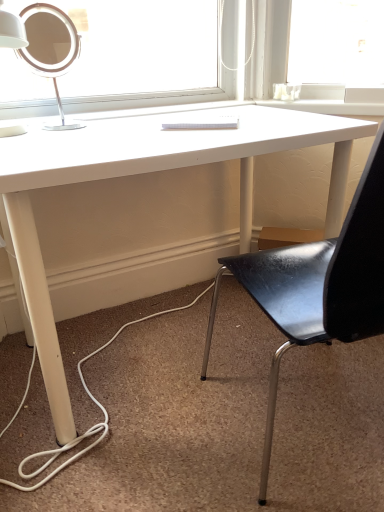
Question: Is black leather chair at center smaller than white matte desk at center?

Choices:
 (A) yes
 (B) no

Answer: (A)

Question: From a real-world perspective, is black leather chair at center on white matte desk at center?

Choices:
 (A) no
 (B) yes

Answer: (B)

Question: Is black leather chair at center taller than white matte desk at center?

Choices:
 (A) no
 (B) yes

Answer: (B)

Question: Is black leather chair at center positioned beyond the bounds of white matte desk at center?

Choices:
 (A) yes
 (B) no

Answer: (A)

Question: Is black leather chair at center far from white matte desk at center?

Choices:
 (A) no
 (B) yes

Answer: (A)

Question: Could you tell me if black leather chair at center is facing white matte desk at center?

Choices:
 (A) no
 (B) yes

Answer: (B)

Question: Are black leather chair at center and matte white lamp at upper left making contact?

Choices:
 (A) yes
 (B) no

Answer: (B)

Question: From a real-world perspective, is black leather chair at center positioned under matte white lamp at upper left based on gravity?

Choices:
 (A) no
 (B) yes

Answer: (B)

Question: Is the position of black leather chair at center more distant than that of matte white lamp at upper left?

Choices:
 (A) no
 (B) yes

Answer: (A)

Question: Is black leather chair at center outside matte white lamp at upper left?

Choices:
 (A) no
 (B) yes

Answer: (B)

Question: From a real-world perspective, is black leather chair at center on matte white lamp at upper left?

Choices:
 (A) no
 (B) yes

Answer: (A)

Question: Does black leather chair at center appear on the right side of matte white lamp at upper left?

Choices:
 (A) no
 (B) yes

Answer: (B)

Question: Is white matte desk at center oriented towards black leather chair at center?

Choices:
 (A) yes
 (B) no

Answer: (A)